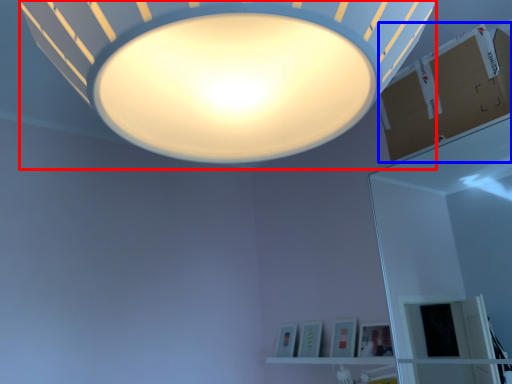
Question: Among these objects, which one is nearest to the camera, lamp (highlighted by a red box) or cardboard box (highlighted by a blue box)?

Choices:
 (A) lamp
 (B) cardboard box

Answer: (A)